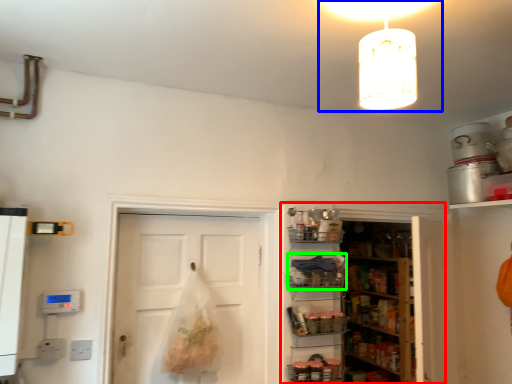
Question: Which object is the farthest from cabinetry (highlighted by a red box)? Choose among these: light fixture (highlighted by a blue box) or shelf (highlighted by a green box).

Choices:
 (A) light fixture
 (B) shelf

Answer: (A)